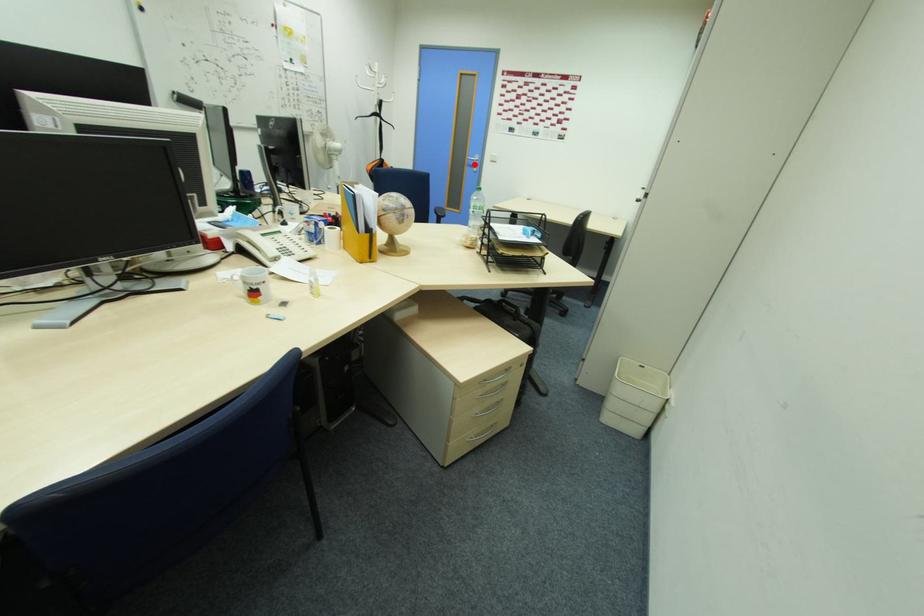
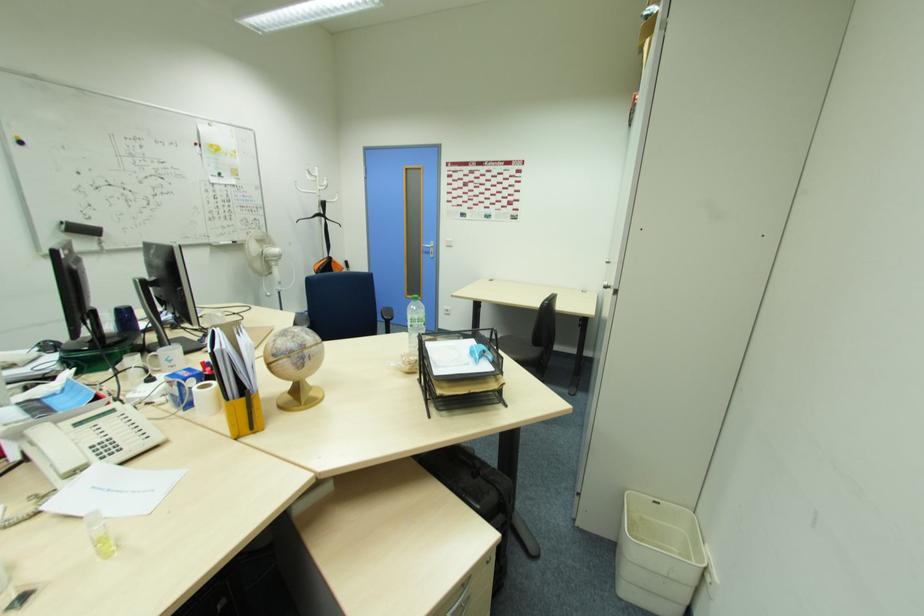
Question: A red point is marked in image1. In image2, is the corresponding 3D point closer to the camera or farther? Reply with the corresponding letter.

Choices:
 (A) The corresponding 3D point is closer.
 (B) The corresponding 3D point is farther.

Answer: (A)